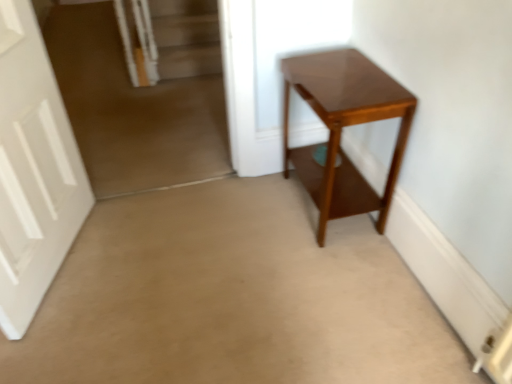
Question: In terms of size, does glossy wood table at center appear bigger or smaller than white matte door at left?

Choices:
 (A) small
 (B) big

Answer: (B)

Question: Visually, is glossy wood table at center positioned to the left or to the right of white matte door at left?

Choices:
 (A) right
 (B) left

Answer: (A)

Question: From a real-world perspective, is glossy wood table at center above or below white matte door at left?

Choices:
 (A) below
 (B) above

Answer: (A)

Question: From their relative heights in the image, would you say white matte door at left is taller or shorter than glossy wood table at center?

Choices:
 (A) short
 (B) tall

Answer: (B)

Question: From a real-world perspective, is white matte door at left physically located above or below glossy wood table at center?

Choices:
 (A) below
 (B) above

Answer: (B)

Question: Do you think white matte door at left is within glossy wood table at center, or outside of it?

Choices:
 (A) inside
 (B) outside

Answer: (B)

Question: In the image, is white matte door at left on the left side or the right side of glossy wood table at center?

Choices:
 (A) right
 (B) left

Answer: (B)